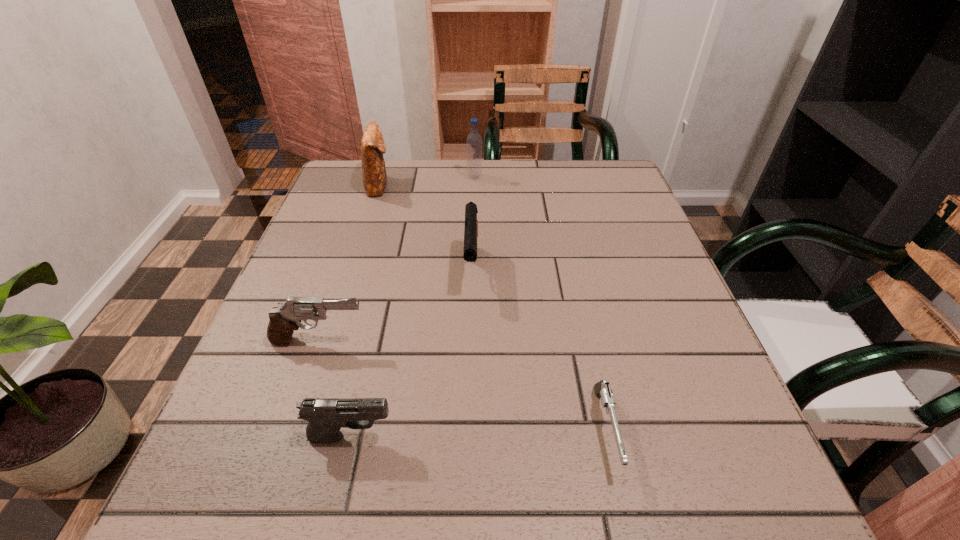
You are a GUI agent. You are given a task and a screenshot of the screen. Output one action in this format:
    pyautogui.click(x=<x>, y=<y>)
    Task: Click on the vacant space at the near edge of the desktop
    This screenshot has width=960, height=540.
    Given the screenshot: What is the action you would take?
    pyautogui.click(x=323, y=469)

Where is `blank space at the left edge of the desktop`? The width and height of the screenshot is (960, 540). blank space at the left edge of the desktop is located at coordinates (259, 390).

You are a GUI agent. You are given a task and a screenshot of the screen. Output one action in this format:
    pyautogui.click(x=<x>, y=<y>)
    Task: Click on the blank space at the right edge of the desktop
    
    Given the screenshot: What is the action you would take?
    pyautogui.click(x=628, y=256)

Locate an element on the screen. The height and width of the screenshot is (540, 960). vacant space at the far left corner of the desktop is located at coordinates (387, 184).

What are the coordinates of `free space at the near left corner of the desktop` in the screenshot? It's located at (223, 484).

This screenshot has width=960, height=540. Find the location of `vacant space at the far right corner of the desktop`. vacant space at the far right corner of the desktop is located at coordinates (617, 178).

This screenshot has width=960, height=540. I want to click on free spot at the near right corner of the desktop, so click(778, 495).

This screenshot has width=960, height=540. In order to click on free space that is in between the second shortest object and the third nearest object in this screenshot , I will do `click(335, 389)`.

Find the location of a particular element. This screenshot has height=540, width=960. vacant space in between the clutch bag and the water bottle is located at coordinates (427, 181).

Find the location of `vacant region between the third nearest pistol and the third pistol from left to right`. vacant region between the third nearest pistol and the third pistol from left to right is located at coordinates (396, 306).